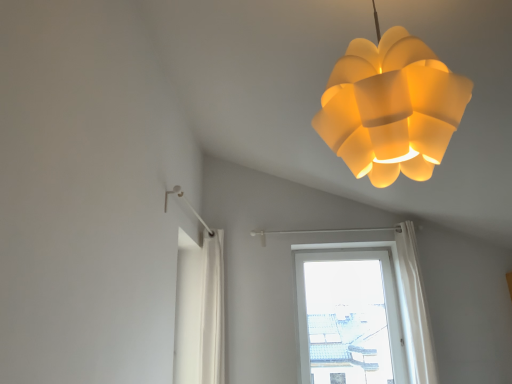
Question: Looking at their shapes, would you say transparent glass window at center is wider or thinner than matte yellow plastic lamp at upper center?

Choices:
 (A) thin
 (B) wide

Answer: (A)

Question: Is transparent glass window at center inside the boundaries of matte yellow plastic lamp at upper center, or outside?

Choices:
 (A) outside
 (B) inside

Answer: (A)

Question: From the image's perspective, is transparent glass window at center positioned above or below matte yellow plastic lamp at upper center?

Choices:
 (A) below
 (B) above

Answer: (A)

Question: Is matte yellow plastic lamp at upper center situated inside transparent glass window at center or outside?

Choices:
 (A) outside
 (B) inside

Answer: (A)

Question: In terms of width, does matte yellow plastic lamp at upper center look wider or thinner when compared to transparent glass window at center?

Choices:
 (A) wide
 (B) thin

Answer: (A)

Question: Is point (367, 155) closer or farther from the camera than point (359, 352)?

Choices:
 (A) farther
 (B) closer

Answer: (B)

Question: Relative to transparent glass window at center, is matte yellow plastic lamp at upper center in front or behind?

Choices:
 (A) front
 (B) behind

Answer: (A)